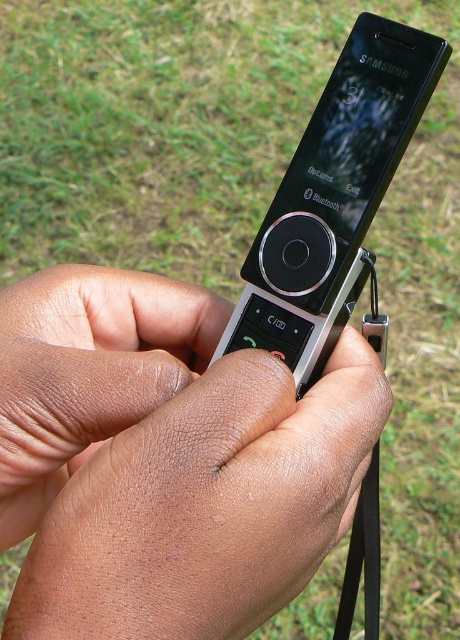
You are a technician trying to secure the Samsung flip phone properly. You have a strap that needs to be attached to the phone. Given that the strap can only reach up to 7 centimeters, will it be able to connect the black glossy phone at center to the black rubber strap at lower right?

The black glossy phone at center and black rubber strap at lower right are 7.66 centimeters apart. Since the strap can only reach up to 7 centimeters, it will not be able to connect the two.

You are a photographer trying to capture a closeup of the Samsung flip phone. You notice the smooth skin hands at center and the black rubber strap at lower right in your frame. Which object should you focus on first if you want to ensure both are in focus?

Since the smooth skin hands at center is closer to the viewer than the black rubber strap at lower right, you should focus on the smooth skin hands at center first to ensure both are in focus.

You are trying to determine if you can comfortably hold both the smooth skin hands at center and the black glossy phone at center in one hand. Based on their sizes, is this possible?

The smooth skin hands at center has a larger size compared to the black glossy phone at center, so it is possible to hold both in one hand since the hands are bigger and can grasp the smaller phone.